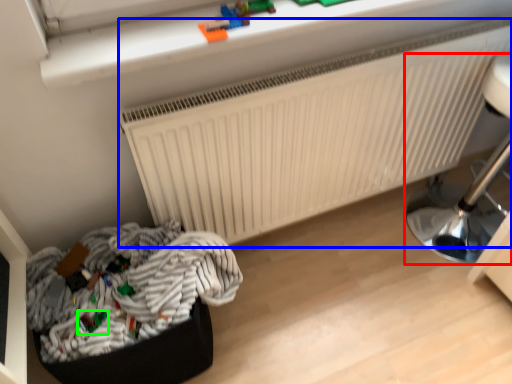
Question: Estimate the real-world distances between objects in this image. Which object is farther from furniture (highlighted by a red box), radiator (highlighted by a blue box) or toy (highlighted by a green box)?

Choices:
 (A) radiator
 (B) toy

Answer: (B)